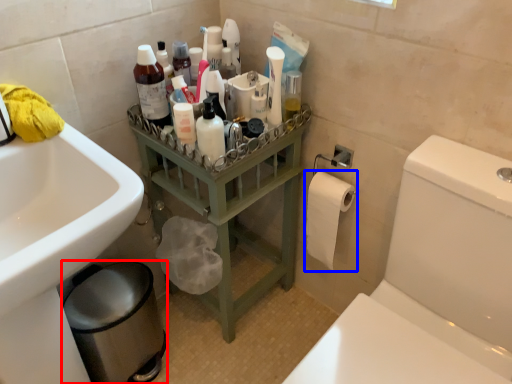
Question: Which point is closer to the camera, bidet (highlighted by a red box) or toilet paper (highlighted by a blue box)?

Choices:
 (A) bidet
 (B) toilet paper

Answer: (A)